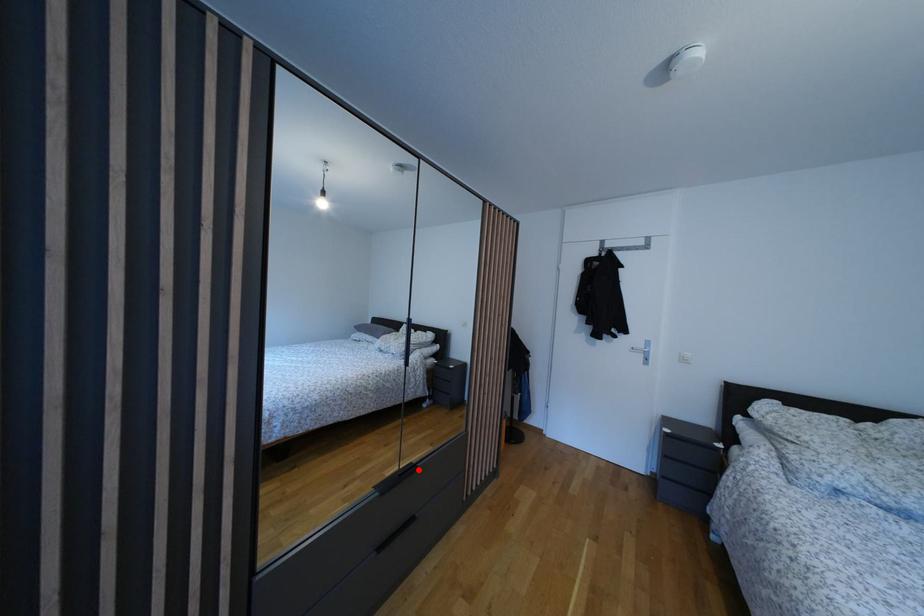
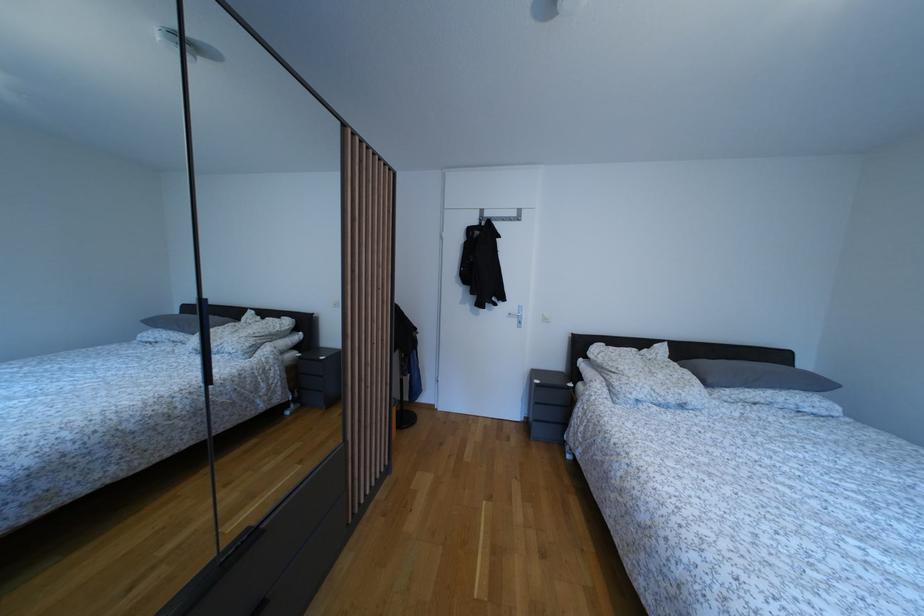
Find the pixel in the second image that matches the highlighted location in the first image.

(254, 535)